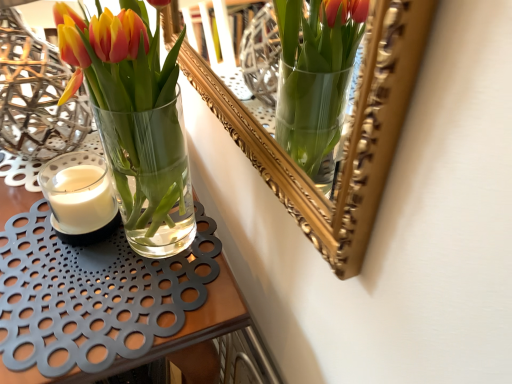
You are a GUI agent. You are given a task and a screenshot of the screen. Output one action in this format:
    pyautogui.click(x=<x>, y=<y>)
    Task: Click on the vacant area that is situated to the right of white matte candle at left
    The image size is (512, 384).
    Given the screenshot: What is the action you would take?
    pyautogui.click(x=166, y=253)